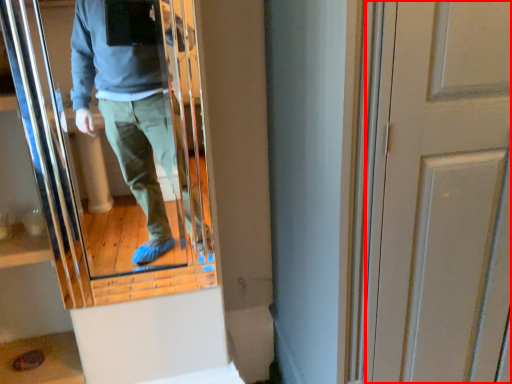
Question: Considering the relative positions of door (annotated by the red box) and mirror in the image provided, where is door (annotated by the red box) located with respect to the staircase?

Choices:
 (A) left
 (B) right

Answer: (B)